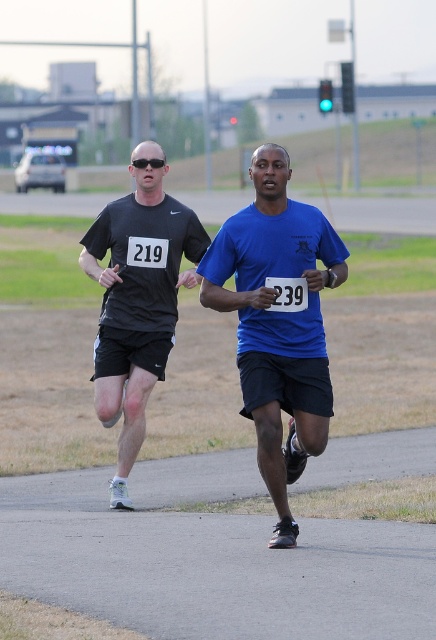
Question: Which object is farther from the camera taking this photo?

Choices:
 (A) matte black shirt at left
 (B) blue matte shirt at center

Answer: (A)

Question: Does blue matte shirt at center appear on the right side of matte black shirt at left?

Choices:
 (A) yes
 (B) no

Answer: (A)

Question: Is blue matte shirt at center to the left of matte black shirt at left from the viewer's perspective?

Choices:
 (A) no
 (B) yes

Answer: (A)

Question: Which object is farther from the camera taking this photo?

Choices:
 (A) blue matte shirt at center
 (B) matte black shirt at left

Answer: (B)

Question: Considering the relative positions of blue matte shirt at center and matte black shirt at left in the image provided, where is blue matte shirt at center located with respect to matte black shirt at left?

Choices:
 (A) left
 (B) right

Answer: (B)

Question: Among these objects, which one is farthest from the camera?

Choices:
 (A) blue matte shirt at center
 (B) matte black shirt at left

Answer: (B)